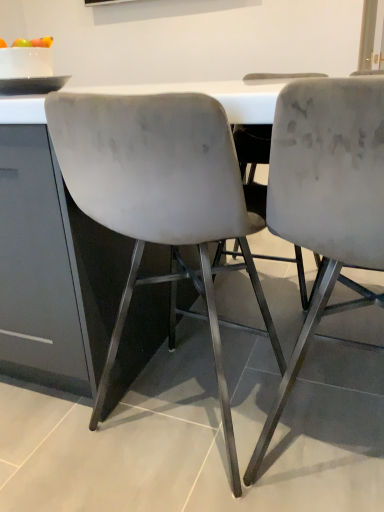
Question: From the image's perspective, does matte gray chair at center, the 1th chair positioned from the left, appear lower than velvet gray chair at center, which ranks as the 2th chair in left-to-right order?

Choices:
 (A) yes
 (B) no

Answer: (B)

Question: Can you confirm if matte gray chair at center, positioned as the 2th chair in right-to-left order, is bigger than velvet gray chair at center, which ranks as the 2th chair in left-to-right order?

Choices:
 (A) yes
 (B) no

Answer: (A)

Question: Is matte gray chair at center, the 1th chair positioned from the left, turned away from velvet gray chair at center, the 1th chair in the right-to-left sequence?

Choices:
 (A) no
 (B) yes

Answer: (A)

Question: Is matte gray chair at center, positioned as the 2th chair in right-to-left order, not within velvet gray chair at center, the 1th chair in the right-to-left sequence?

Choices:
 (A) no
 (B) yes

Answer: (B)

Question: From a real-world perspective, is matte gray chair at center, positioned as the 2th chair in right-to-left order, positioned over velvet gray chair at center, the 1th chair in the right-to-left sequence, based on gravity?

Choices:
 (A) yes
 (B) no

Answer: (A)

Question: Can you confirm if matte gray chair at center, the 1th chair positioned from the left, is wider than velvet gray chair at center, which ranks as the 2th chair in left-to-right order?

Choices:
 (A) no
 (B) yes

Answer: (A)

Question: Can matte gray chair at center, positioned as the 2th chair in right-to-left order, be found inside velvet gray chair at center, which ranks as the 2th chair in left-to-right order?

Choices:
 (A) no
 (B) yes

Answer: (A)

Question: Is velvet gray chair at center, which ranks as the 2th chair in left-to-right order, bigger than matte gray chair at center, positioned as the 2th chair in right-to-left order?

Choices:
 (A) no
 (B) yes

Answer: (A)

Question: Is velvet gray chair at center, which ranks as the 2th chair in left-to-right order, positioned far away from matte gray chair at center, positioned as the 2th chair in right-to-left order?

Choices:
 (A) yes
 (B) no

Answer: (B)

Question: Can you confirm if velvet gray chair at center, which ranks as the 2th chair in left-to-right order, is wider than matte gray chair at center, positioned as the 2th chair in right-to-left order?

Choices:
 (A) no
 (B) yes

Answer: (B)

Question: Is velvet gray chair at center, the 1th chair in the right-to-left sequence, outside of matte gray chair at center, the 1th chair positioned from the left?

Choices:
 (A) no
 (B) yes

Answer: (B)

Question: From a real-world perspective, is velvet gray chair at center, the 1th chair in the right-to-left sequence, located beneath matte gray chair at center, positioned as the 2th chair in right-to-left order?

Choices:
 (A) yes
 (B) no

Answer: (A)

Question: In terms of height, does velvet gray chair at center, which ranks as the 2th chair in left-to-right order, look taller or shorter compared to matte gray chair at center, positioned as the 2th chair in right-to-left order?

Choices:
 (A) short
 (B) tall

Answer: (B)